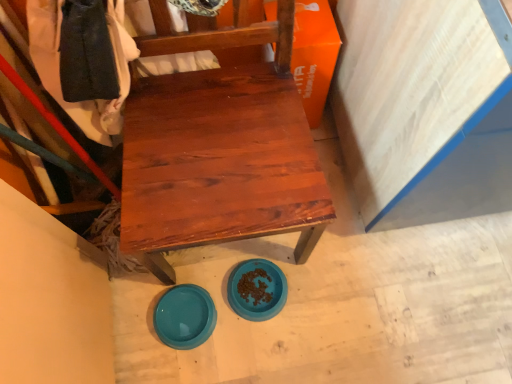
This screenshot has width=512, height=384. I want to click on vacant space in front of blue plastic bowl at lower center, the 1th plate positioned from the right, so click(x=256, y=352).